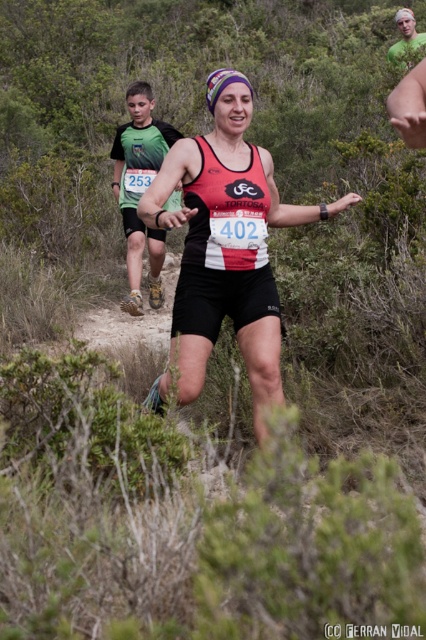
Between point (242, 193) and point (394, 45), which one is positioned behind?

Point (394, 45)

Does matte black tank top at center come behind blonde hair at upper right?

No, it is in front of blonde hair at upper right.

Identify the location of matte black tank top at center. (227, 243).

At what (x,y) coordinates should I click in order to perform the action: click on matte black tank top at center. Please return your answer as a coordinate pair (x, y). This screenshot has width=426, height=640. Looking at the image, I should click on (227, 243).

Between green fabric shirt at left and blonde hair at upper right, which one appears on the right side from the viewer's perspective?

blonde hair at upper right

What do you see at coordinates (138, 177) in the screenshot?
I see `green fabric shirt at left` at bounding box center [138, 177].

At what (x,y) coordinates should I click in order to perform the action: click on green fabric shirt at left. Please return your answer as a coordinate pair (x, y). The image size is (426, 640). Looking at the image, I should click on (138, 177).

Is matte black tank top at center above green fabric shirt at left?

Actually, matte black tank top at center is below green fabric shirt at left.

Between matte black tank top at center and green fabric shirt at left, which one is positioned lower?

matte black tank top at center is below.

I want to click on matte black tank top at center, so click(x=227, y=243).